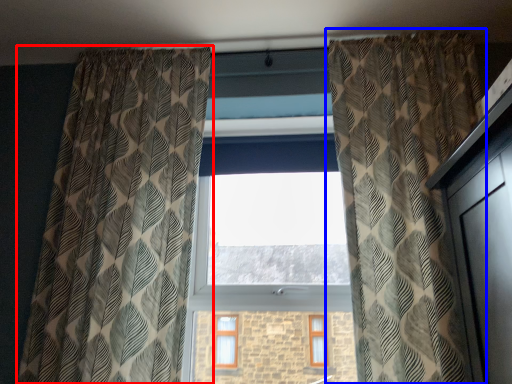
Question: Which of the following is the farthest to the observer, curtain (highlighted by a red box) or curtain (highlighted by a blue box)?

Choices:
 (A) curtain
 (B) curtain

Answer: (A)